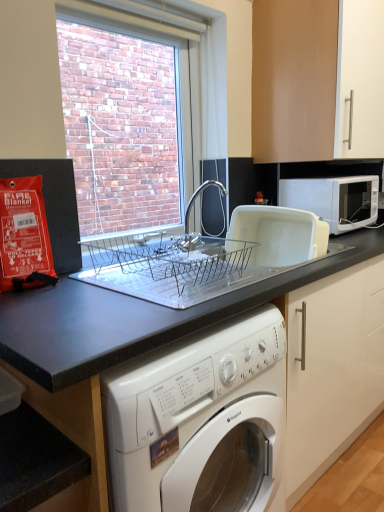
Question: In the image, is white plastic dish drainer at upper right on the left side or the right side of black granite countertop at center?

Choices:
 (A) right
 (B) left

Answer: (A)

Question: From the image's perspective, is white plastic dish drainer at upper right above or below black granite countertop at center?

Choices:
 (A) above
 (B) below

Answer: (A)

Question: Estimate the real-world distances between objects in this image. Which object is farther from the white matte microwave at upper right?

Choices:
 (A) clear glass window screen at upper center
 (B) black granite countertop at center
 (C) matte wood cabinet at upper right
 (D) white plastic dish drainer at upper right

Answer: (A)

Question: Which object is the farthest from the white plastic dish drainer at upper right?

Choices:
 (A) matte wood cabinet at upper right
 (B) clear glass window screen at upper center
 (C) white matte microwave at upper right
 (D) black granite countertop at center

Answer: (B)